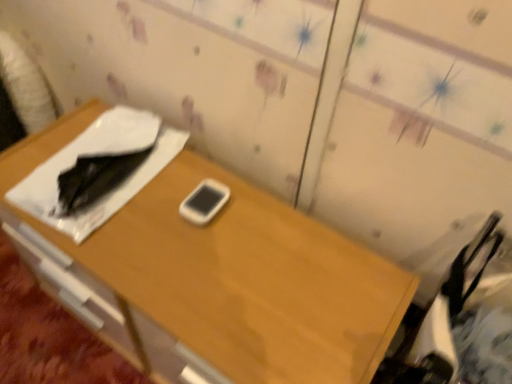
You are a GUI agent. You are given a task and a screenshot of the screen. Output one action in this format:
    pyautogui.click(x=<x>, y=<y>)
    Task: Click on the vacant space to the right of white matte mobile phone at center
    
    Given the screenshot: What is the action you would take?
    pyautogui.click(x=265, y=227)